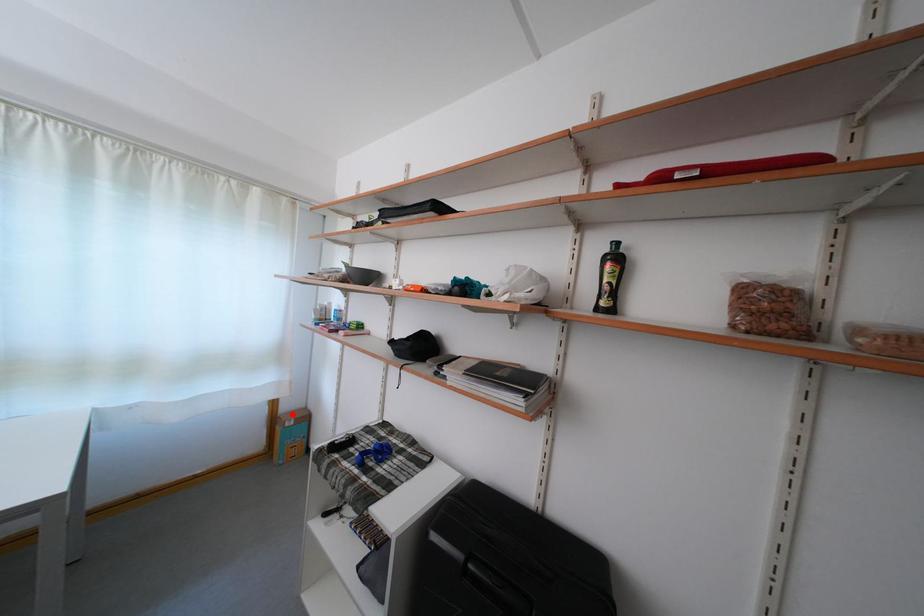
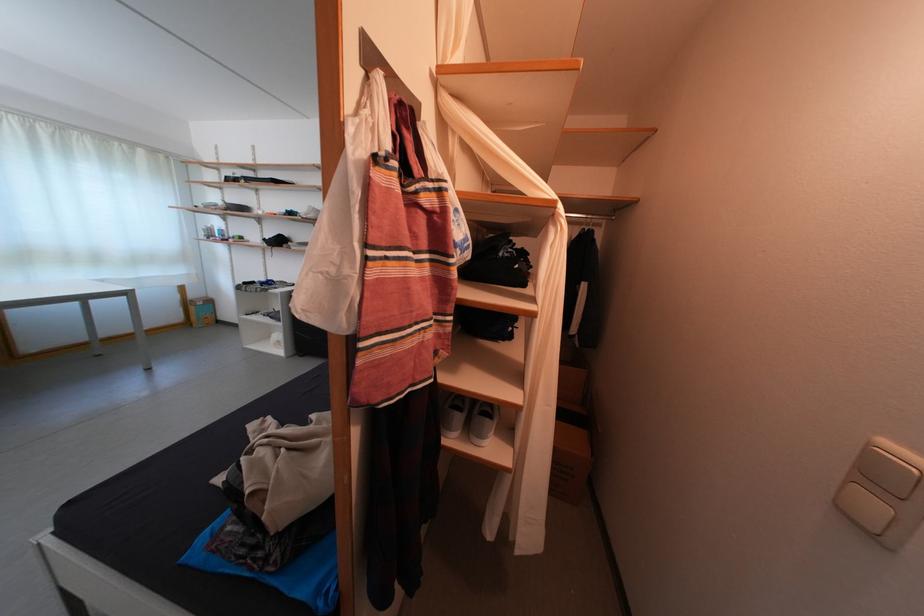
The point at the highlighted location is marked in the first image. Where is the corresponding point in the second image?

(201, 302)